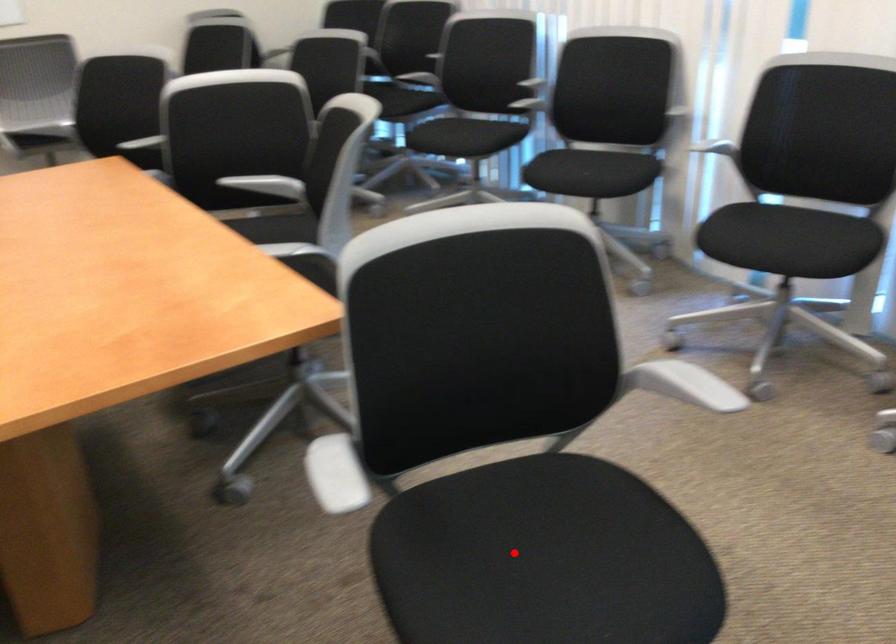
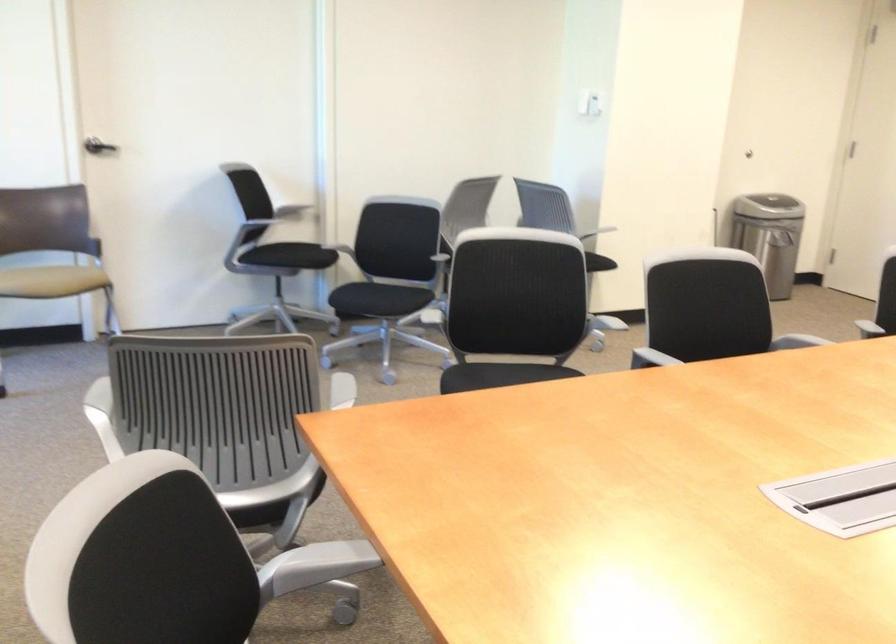
Question: I am providing you with two images of the same scene from different viewpoints. A red point is marked on the first image. Can you still see the location of the red point in image 2?

Choices:
 (A) Yes
 (B) No

Answer: (B)